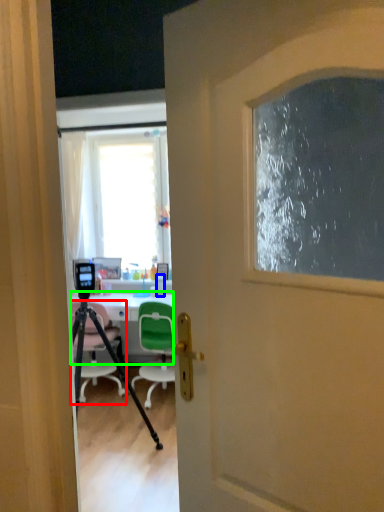
Question: Which object is positioned closest to chair (highlighted by a red box)? Select from bottle (highlighted by a blue box) and desk (highlighted by a green box).

Choices:
 (A) bottle
 (B) desk

Answer: (B)